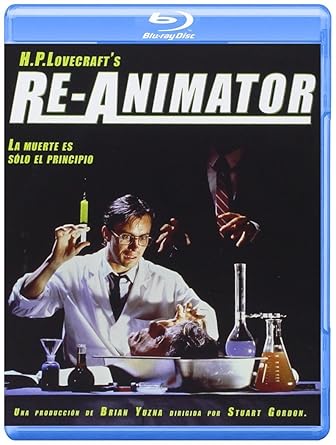
You are a GUI agent. You are given a task and a screenshot of the screen. Output one action in this format:
    pyautogui.click(x=<x>, y=<y>)
    Task: Click on the coat
    The height and width of the screenshot is (445, 336).
    Given the screenshot: What is the action you would take?
    pyautogui.click(x=165, y=293), pyautogui.click(x=80, y=316)